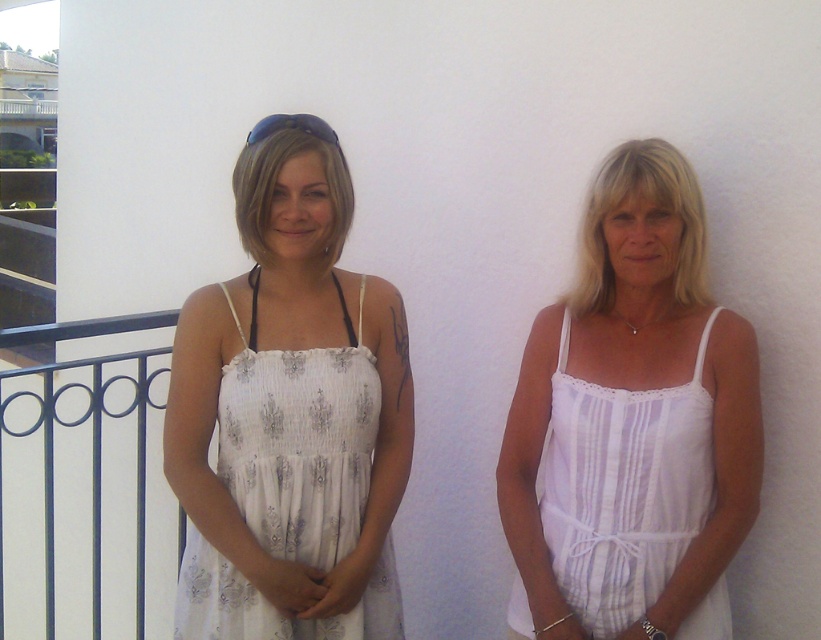
Question: Can you confirm if white sheer fabric dress at center is positioned below white striped fabric dress at right?

Choices:
 (A) no
 (B) yes

Answer: (A)

Question: Is white sheer fabric dress at center above white striped fabric dress at right?

Choices:
 (A) yes
 (B) no

Answer: (A)

Question: Is white sheer fabric dress at center positioned behind white striped fabric dress at right?

Choices:
 (A) yes
 (B) no

Answer: (A)

Question: Which point is farther to the camera?

Choices:
 (A) white striped fabric dress at right
 (B) white sheer fabric dress at center

Answer: (B)